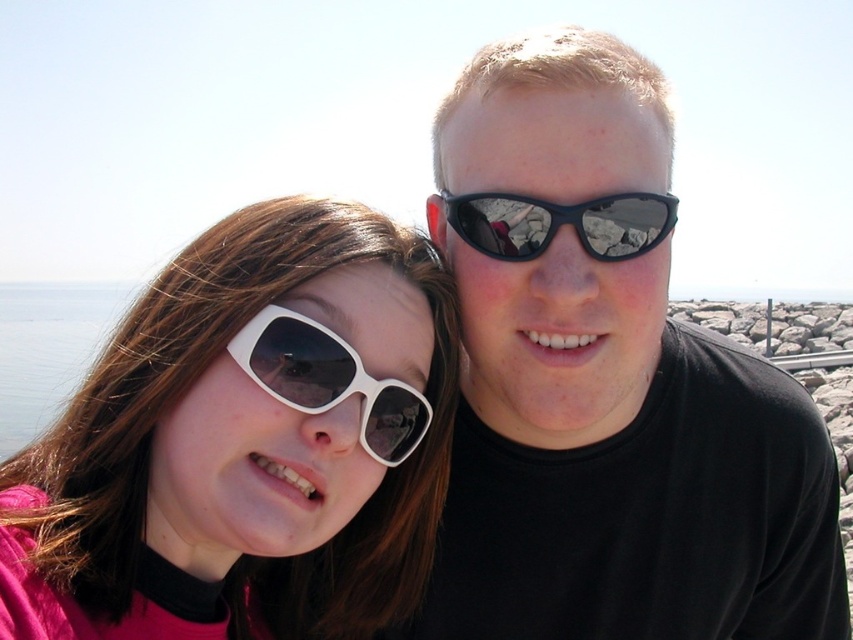
This screenshot has height=640, width=853. Identify the location of matte black sunglasses at upper right. (606, 385).

Is point (550, 264) closer to camera compared to point (303, 339)?

That is False.

What do you see at coordinates (606, 385) in the screenshot?
I see `matte black sunglasses at upper right` at bounding box center [606, 385].

In order to click on matte black sunglasses at upper right in this screenshot , I will do `click(606, 385)`.

Does matte black sunglasses at upper right appear under black reflective sunglasses at upper center?

Correct, matte black sunglasses at upper right is located below black reflective sunglasses at upper center.

Can you confirm if matte black sunglasses at upper right is positioned to the left of black reflective sunglasses at upper center?

Indeed, matte black sunglasses at upper right is positioned on the left side of black reflective sunglasses at upper center.

Which is in front, point (471, 177) or point (503, 211)?

Point (503, 211)

Identify the location of matte black sunglasses at upper right. (606, 385).

Based on the photo, who is positioned more to the left, white matte sunglasses at center or black reflective sunglasses at upper center?

white matte sunglasses at center

Who is more distant from viewer, (296, 326) or (462, 232)?

The point (462, 232) is behind.

Find the location of a particular element. This screenshot has height=640, width=853. white matte sunglasses at center is located at coordinates 329,380.